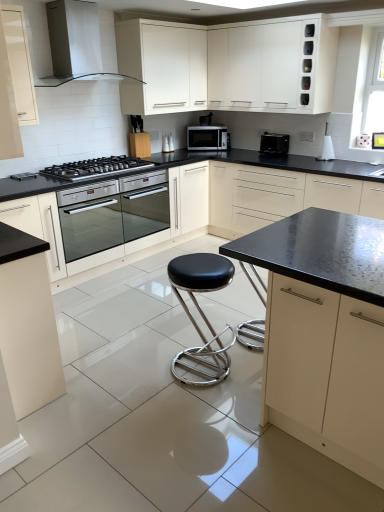
Question: Considering the relative positions of black leather stool at center and matte cream cabinet at upper left, the first cabinetry from the left, in the image provided, is black leather stool at center to the right of matte cream cabinet at upper left, the first cabinetry from the left, from the viewer's perspective?

Choices:
 (A) no
 (B) yes

Answer: (B)

Question: Is black leather stool at center taller than matte cream cabinet at upper left, the first cabinetry from the left?

Choices:
 (A) no
 (B) yes

Answer: (A)

Question: Does black leather stool at center have a smaller size compared to matte cream cabinet at upper left, the first cabinetry from the left?

Choices:
 (A) no
 (B) yes

Answer: (A)

Question: Is black leather stool at center far from matte cream cabinet at upper left, the first cabinetry from the left?

Choices:
 (A) no
 (B) yes

Answer: (B)

Question: From a real-world perspective, is black leather stool at center physically above matte cream cabinet at upper left, acting as the 6th cabinetry starting from the right?

Choices:
 (A) yes
 (B) no

Answer: (B)

Question: Is black leather stool at center located outside matte cream cabinet at upper left, acting as the 6th cabinetry starting from the right?

Choices:
 (A) yes
 (B) no

Answer: (A)

Question: From the image's perspective, does white glossy range hood at upper left appear higher than black stainless steel gas stove at left?

Choices:
 (A) no
 (B) yes

Answer: (B)

Question: Is white glossy range hood at upper left to the left of black stainless steel gas stove at left from the viewer's perspective?

Choices:
 (A) no
 (B) yes

Answer: (B)

Question: Does white glossy range hood at upper left have a greater height compared to black stainless steel gas stove at left?

Choices:
 (A) no
 (B) yes

Answer: (B)

Question: Considering the relative positions of white glossy range hood at upper left and black stainless steel gas stove at left in the image provided, is white glossy range hood at upper left to the right of black stainless steel gas stove at left from the viewer's perspective?

Choices:
 (A) no
 (B) yes

Answer: (A)

Question: Does white glossy range hood at upper left have a lesser width compared to black stainless steel gas stove at left?

Choices:
 (A) yes
 (B) no

Answer: (A)

Question: Is white glossy range hood at upper left facing away from black stainless steel gas stove at left?

Choices:
 (A) no
 (B) yes

Answer: (A)

Question: From a real-world perspective, is black leather stool at center beneath satin silver microwave at center, the second kitchen appliance in the right-to-left sequence?

Choices:
 (A) no
 (B) yes

Answer: (B)